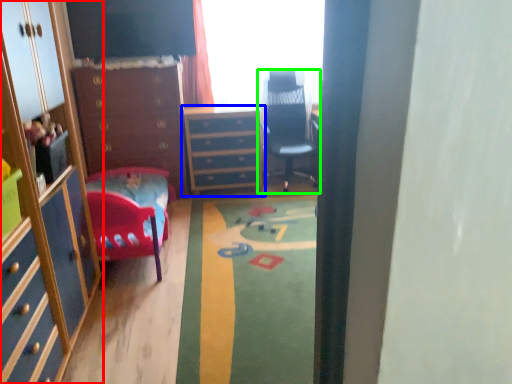
Question: Which is farther away from cabinetry (highlighted by a red box)? chest of drawers (highlighted by a blue box) or chair (highlighted by a green box)?

Choices:
 (A) chest of drawers
 (B) chair

Answer: (B)